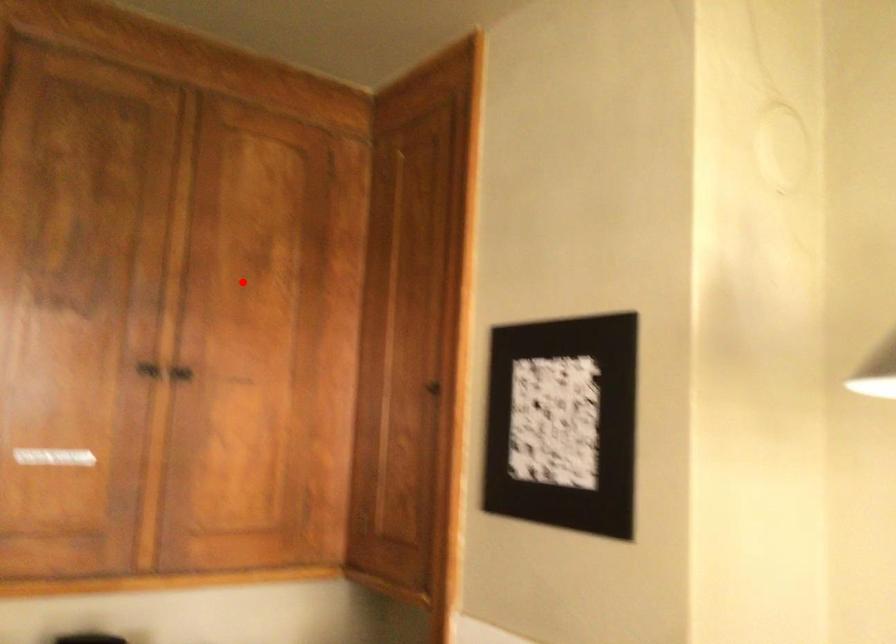
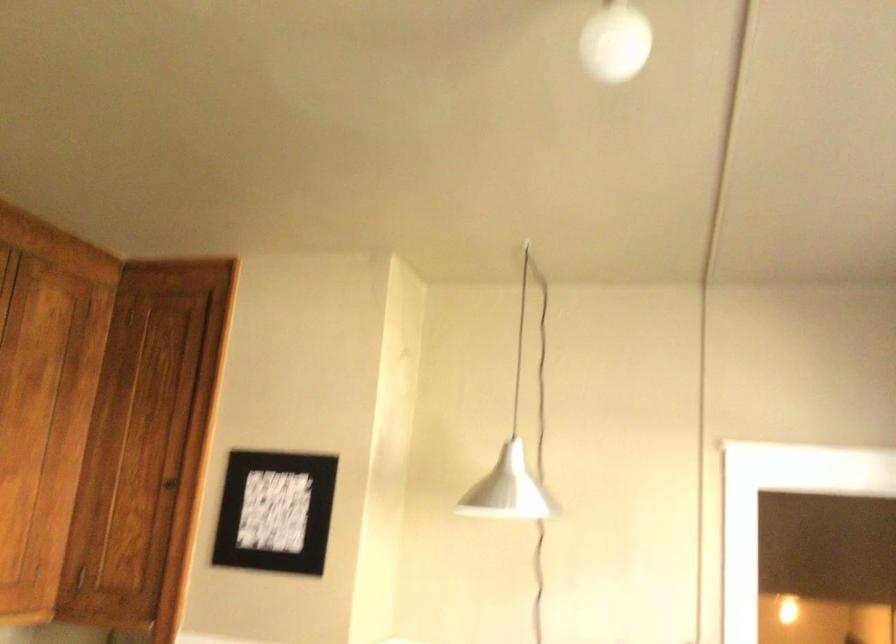
Question: I am providing you with two images of the same scene from different viewpoints. Image1 has a red point marked. In image2, the corresponding 3D location appears at what relative position? Reply with the corresponding letter.

Choices:
 (A) Closer
 (B) Farther

Answer: (B)